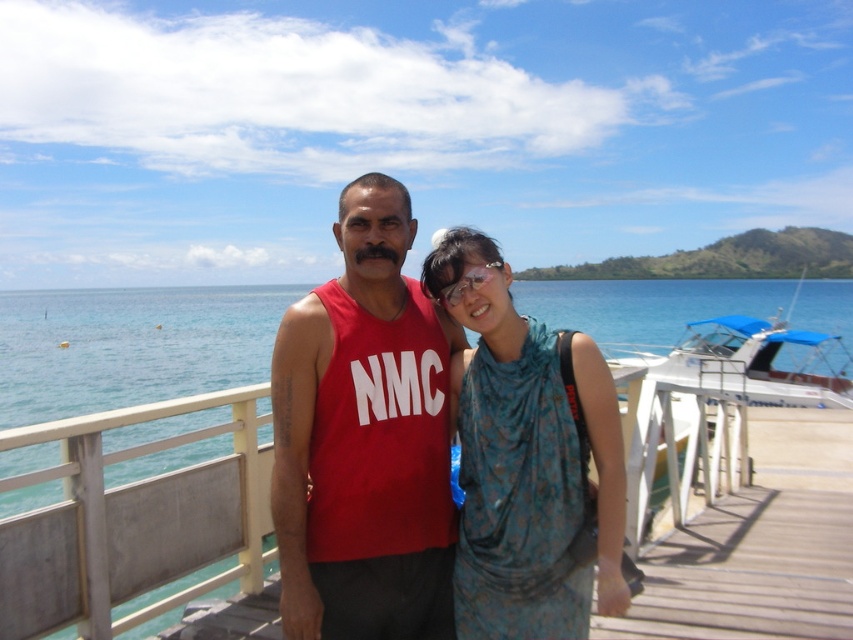
Question: Is matte red tank top at center to the right of blue water at center from the viewer's perspective?

Choices:
 (A) yes
 (B) no

Answer: (B)

Question: From the image, what is the correct spatial relationship of matte red tank top at center in relation to blue floral dress at center?

Choices:
 (A) right
 (B) left

Answer: (B)

Question: Which object is positioned farthest from the matte red tank top at center?

Choices:
 (A) blue water at center
 (B) blue floral dress at center

Answer: (A)

Question: Which point appears farthest from the camera in this image?

Choices:
 (A) (68, 305)
 (B) (352, 600)
 (C) (517, 589)

Answer: (A)

Question: Which object is farther from the camera taking this photo?

Choices:
 (A) blue floral dress at center
 (B) matte red tank top at center
 (C) blue water at center

Answer: (C)

Question: Is matte red tank top at center further to the viewer compared to blue floral dress at center?

Choices:
 (A) yes
 (B) no

Answer: (A)